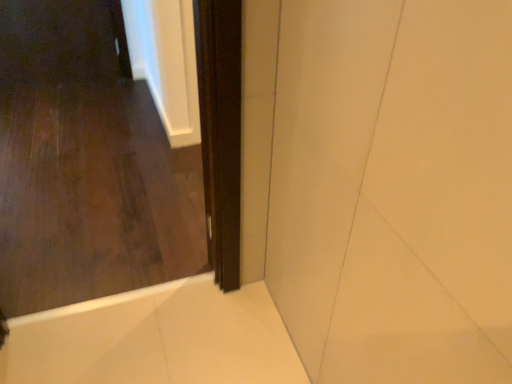
Where is `free region under dark wood door at center (from a real-world perspective)`? Image resolution: width=512 pixels, height=384 pixels. free region under dark wood door at center (from a real-world perspective) is located at coordinates (109, 311).